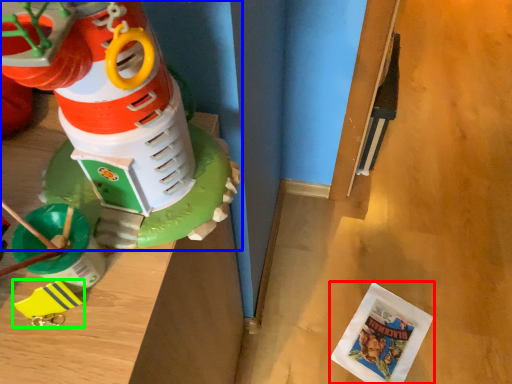
Question: Which is nearer to the comic book (highlighted by a red box)? toy (highlighted by a blue box) or toy (highlighted by a green box).

Choices:
 (A) toy
 (B) toy

Answer: (A)